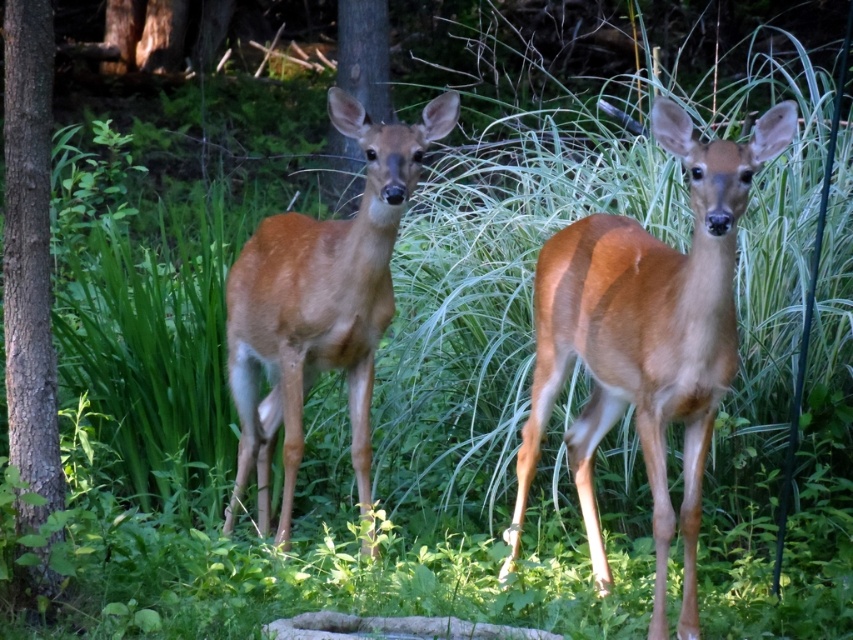
Question: Is brown fur deer at center smaller than brown wood tree at center?

Choices:
 (A) no
 (B) yes

Answer: (A)

Question: Which object appears farthest from the camera in this image?

Choices:
 (A) brown fur deer at center
 (B) brown rough bark tree at left
 (C) brown matte/deer at center

Answer: (A)

Question: Can you confirm if brown matte/deer at center is positioned to the right of brown fur deer at center?

Choices:
 (A) no
 (B) yes

Answer: (B)

Question: Which point is closer to the camera taking this photo?

Choices:
 (A) (10, 209)
 (B) (635, 273)
 (C) (291, 464)
 (D) (352, 144)

Answer: (A)

Question: Which point is closer to the camera?

Choices:
 (A) (370, 83)
 (B) (30, 108)
 (C) (282, 266)
 (D) (607, 588)

Answer: (B)

Question: Can you confirm if brown matte/deer at center is smaller than brown wood tree at center?

Choices:
 (A) no
 (B) yes

Answer: (A)